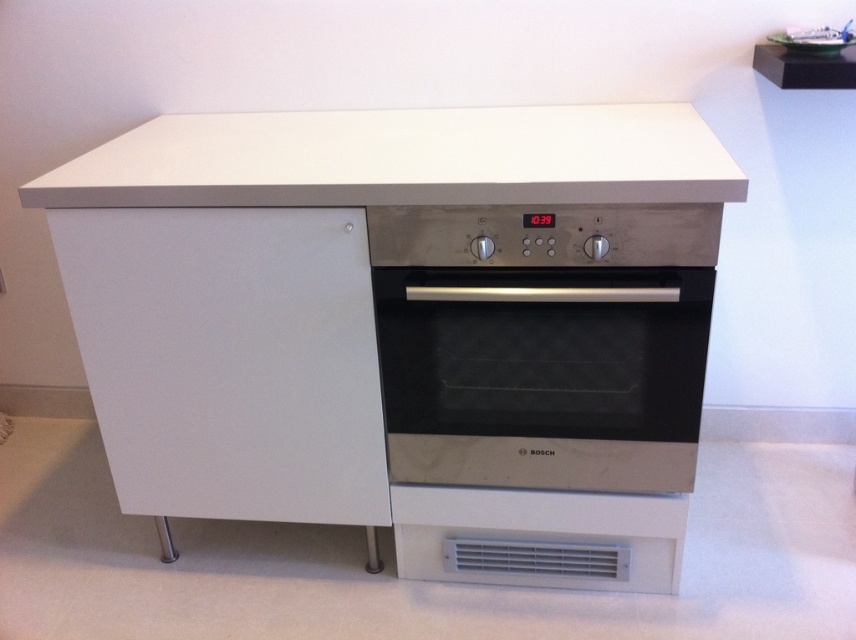
Question: Does white matte drawer at left appear over white matte countertop at upper center?

Choices:
 (A) no
 (B) yes

Answer: (A)

Question: Is stainless steel oven at center thinner than white matte countertop at upper center?

Choices:
 (A) no
 (B) yes

Answer: (B)

Question: Which point is closer to the camera taking this photo?

Choices:
 (A) (637, 145)
 (B) (221, 428)
 (C) (479, 435)

Answer: (A)

Question: Can you confirm if stainless steel oven at center is bigger than white matte countertop at upper center?

Choices:
 (A) yes
 (B) no

Answer: (B)

Question: Among these objects, which one is farthest from the camera?

Choices:
 (A) white matte drawer at left
 (B) stainless steel oven at center

Answer: (A)

Question: Which point is closer to the camera?

Choices:
 (A) white matte drawer at left
 (B) stainless steel oven at center
 (C) white matte countertop at upper center

Answer: (C)